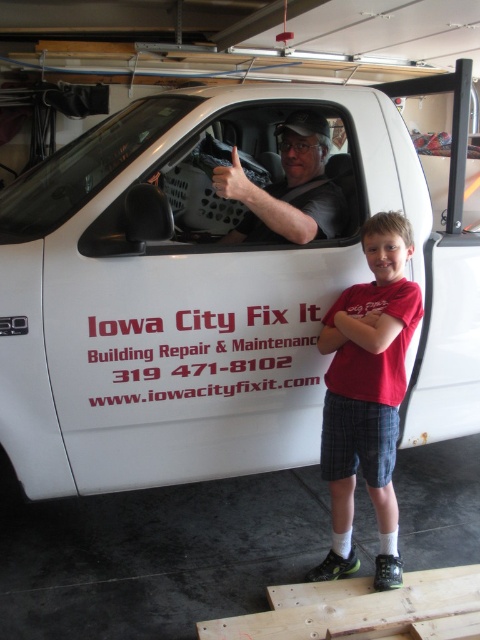
Question: Is red cotton shirt at center in front of transparent glass windshield at upper left?

Choices:
 (A) yes
 (B) no

Answer: (A)

Question: Is white matte van at center thinner than red cotton shirt at center?

Choices:
 (A) yes
 (B) no

Answer: (B)

Question: Among these points, which one is farthest from the camera?

Choices:
 (A) (241, 232)
 (B) (346, 497)
 (C) (112, 195)
 (D) (128, 134)

Answer: (A)

Question: From the image, what is the correct spatial relationship of white matte van at center in relation to transparent glass windshield at upper left?

Choices:
 (A) below
 (B) above

Answer: (A)

Question: Which point appears closest to the camera in this image?

Choices:
 (A) (367, 438)
 (B) (118, 120)
 (C) (336, 147)

Answer: (A)

Question: Which point is closer to the camera?

Choices:
 (A) (295, 460)
 (B) (392, 461)
 (C) (290, 212)

Answer: (B)